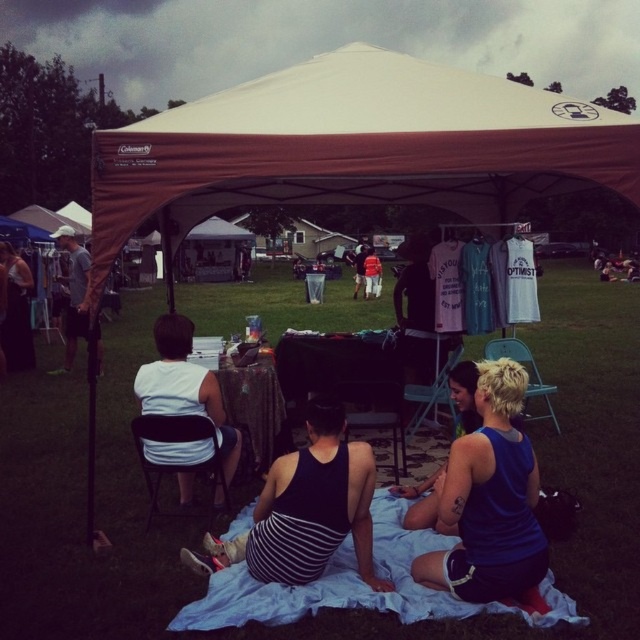
Question: Which of the following is the farthest from the observer?

Choices:
 (A) matte white shirt at center
 (B) white t-shirt at center
 (C) blue tank top at lower right
 (D) white fabric shirt at left

Answer: (A)

Question: Estimate the real-world distances between objects in this image. Which object is closer to the white t-shirt at center?

Choices:
 (A) blue tank top at lower right
 (B) matte gray shirt at left

Answer: (B)

Question: Does green grass at center appear under blue tank top at lower right?

Choices:
 (A) no
 (B) yes

Answer: (A)

Question: From the image, what is the correct spatial relationship of blue fabric tank top at lower right in relation to white fabric shirt at left?

Choices:
 (A) right
 (B) left

Answer: (A)

Question: Which object appears closest to the camera in this image?

Choices:
 (A) matte white shirt at center
 (B) matte black camera at left
 (C) white fabric shirt at left

Answer: (C)

Question: Is matte black camera at left in front of matte white shirt at center?

Choices:
 (A) yes
 (B) no

Answer: (A)